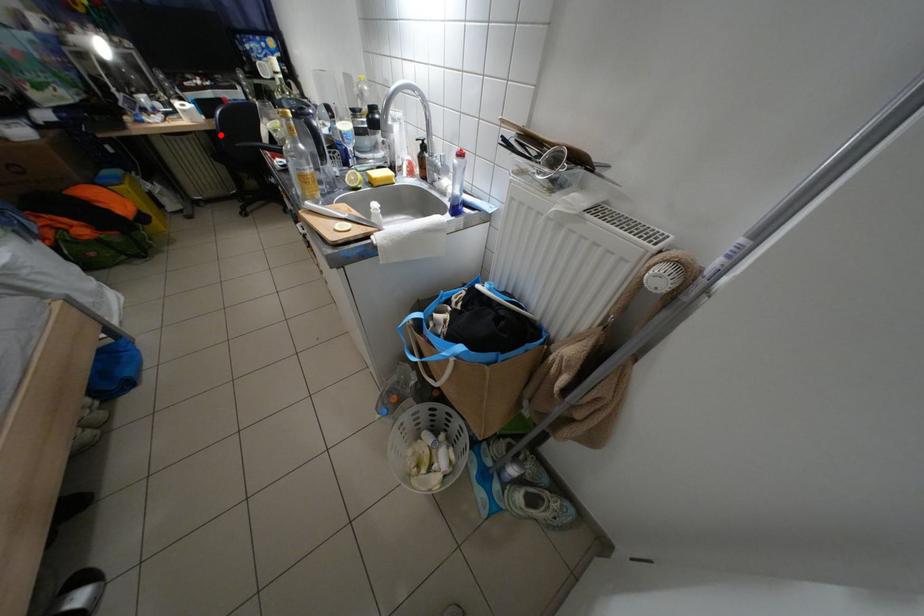
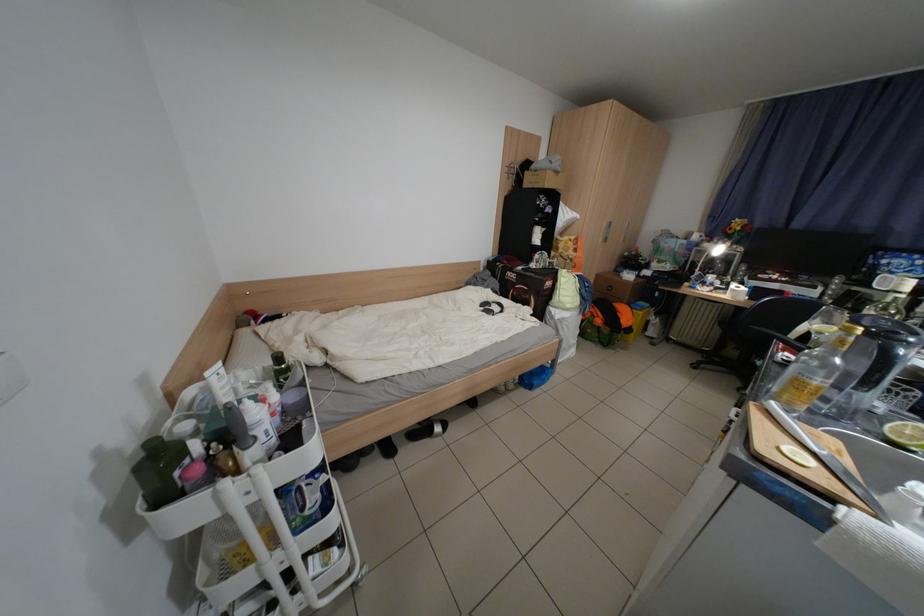
Find the pixel in the second image that matches the highlighted location in the first image.

(748, 310)